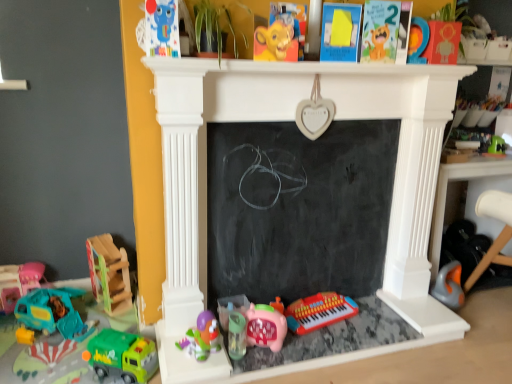
The height and width of the screenshot is (384, 512). I want to click on vacant space in front of orange plastic vacuum cleaner at lower right, the 1th toy viewed from the right, so click(481, 326).